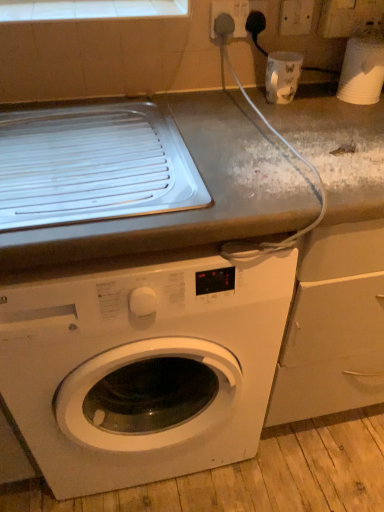
Question: Is white tile at upper center placed right next to white glossy washing machine at center?

Choices:
 (A) yes
 (B) no

Answer: (B)

Question: Considering the relative sizes of white tile at upper center and white glossy washing machine at center in the image provided, is white tile at upper center shorter than white glossy washing machine at center?

Choices:
 (A) yes
 (B) no

Answer: (A)

Question: Considering the relative sizes of white tile at upper center and white glossy washing machine at center in the image provided, is white tile at upper center taller than white glossy washing machine at center?

Choices:
 (A) yes
 (B) no

Answer: (B)

Question: Is white tile at upper center completely or partially outside of white glossy washing machine at center?

Choices:
 (A) no
 (B) yes

Answer: (B)

Question: Is white tile at upper center to the right of white glossy washing machine at center from the viewer's perspective?

Choices:
 (A) no
 (B) yes

Answer: (A)

Question: Can you confirm if white tile at upper center is thinner than white glossy washing machine at center?

Choices:
 (A) yes
 (B) no

Answer: (A)

Question: Are white plastic cup at upper right, the 2th appliance in the left-to-right sequence, and white glossy cup at upper right, arranged as the 2th appliance when viewed from the right, located far from each other?

Choices:
 (A) yes
 (B) no

Answer: (B)

Question: Is the position of white plastic cup at upper right, the 2th appliance in the left-to-right sequence, more distant than that of white glossy cup at upper right, arranged as the 2th appliance when viewed from the right?

Choices:
 (A) no
 (B) yes

Answer: (A)

Question: From a real-world perspective, is white plastic cup at upper right, which appears as the first appliance when viewed from the right, on top of white glossy cup at upper right, arranged as the 2th appliance when viewed from the right?

Choices:
 (A) no
 (B) yes

Answer: (B)

Question: Does white plastic cup at upper right, which appears as the first appliance when viewed from the right, have a smaller size compared to white glossy cup at upper right, arranged as the 2th appliance when viewed from the right?

Choices:
 (A) no
 (B) yes

Answer: (A)

Question: Is white plastic cup at upper right, which appears as the first appliance when viewed from the right, bigger than white glossy cup at upper right, acting as the first appliance starting from the left?

Choices:
 (A) yes
 (B) no

Answer: (A)

Question: Is white plastic cup at upper right, the 2th appliance in the left-to-right sequence, next to white glossy cup at upper right, arranged as the 2th appliance when viewed from the right, and touching it?

Choices:
 (A) yes
 (B) no

Answer: (B)

Question: Considering the relative positions of white glossy cup at upper right, arranged as the 2th appliance when viewed from the right, and white tile at upper center in the image provided, is white glossy cup at upper right, arranged as the 2th appliance when viewed from the right, to the left of white tile at upper center from the viewer's perspective?

Choices:
 (A) no
 (B) yes

Answer: (A)